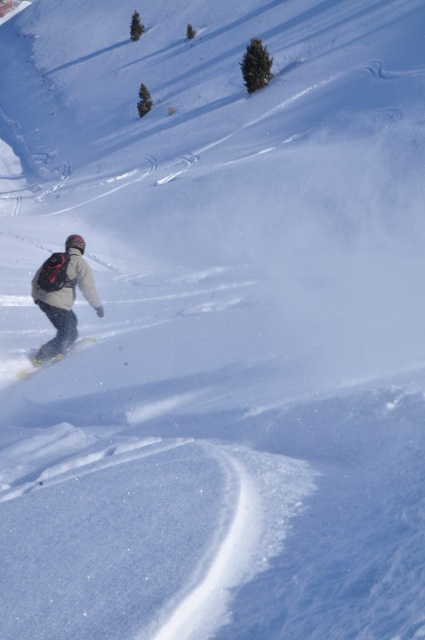
Does matte black snowboarder at lower left have a lesser height compared to white matte snowboard at lower left?

No.

In the scene shown: Can you confirm if matte black snowboarder at lower left is wider than white matte snowboard at lower left?

Yes.

Which is behind, point (90, 298) or point (27, 376)?

The point (27, 376) is behind.

The height and width of the screenshot is (640, 425). Find the location of `matte black snowboarder at lower left`. matte black snowboarder at lower left is located at coordinates (62, 294).